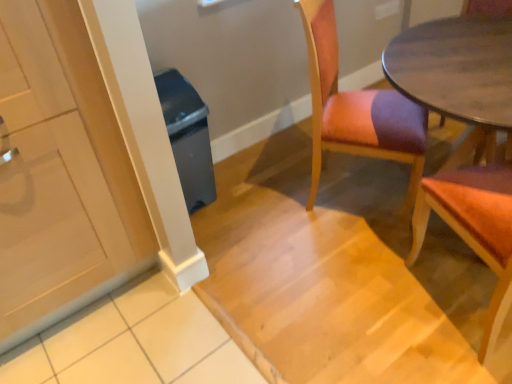
Find the location of a particular element. vacant area that is in front of wooden upholstered chair at center, the first chair viewed from the left is located at coordinates (344, 268).